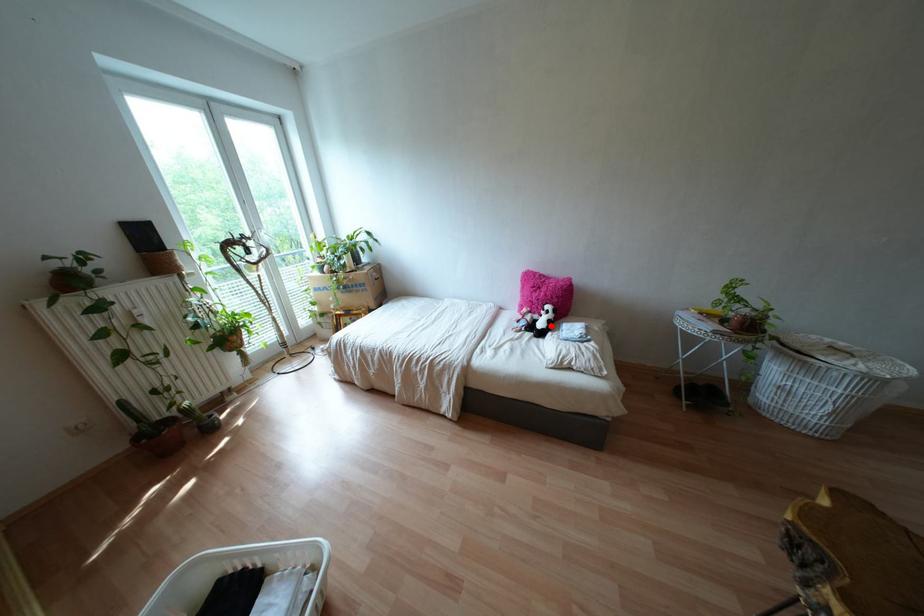
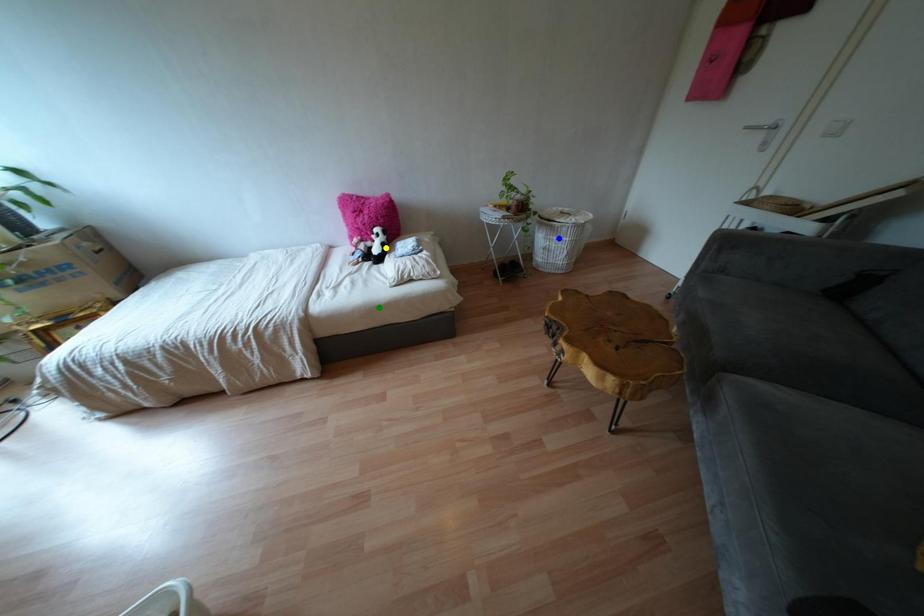
Question: I am providing you with two images of the same scene from different viewpoints. A red point is marked on the first image. You are given multiple points on the second image. Which mark in image 2 goes with the point in image 1?

Choices:
 (A) yellow point
 (B) green point
 (C) blue point

Answer: (A)